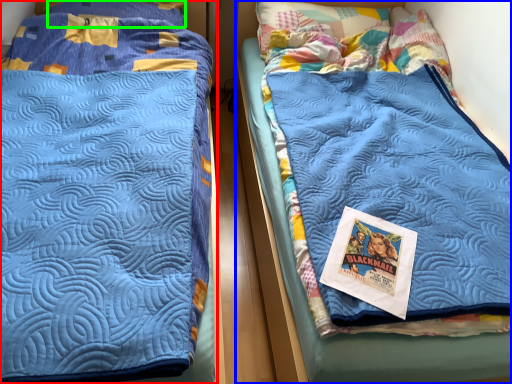
Question: Considering the real-world distances, which object is closest to bed (highlighted by a red box)? bed (highlighted by a blue box) or pillow (highlighted by a green box).

Choices:
 (A) bed
 (B) pillow

Answer: (A)